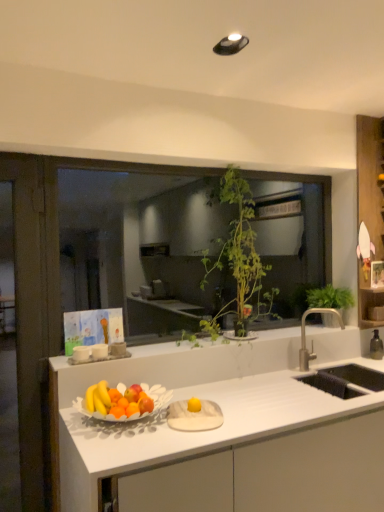
Image resolution: width=384 pixels, height=512 pixels. What are the coordinates of `free location above wooden shelf at right (from a real-world perspective)` in the screenshot? It's located at click(x=373, y=114).